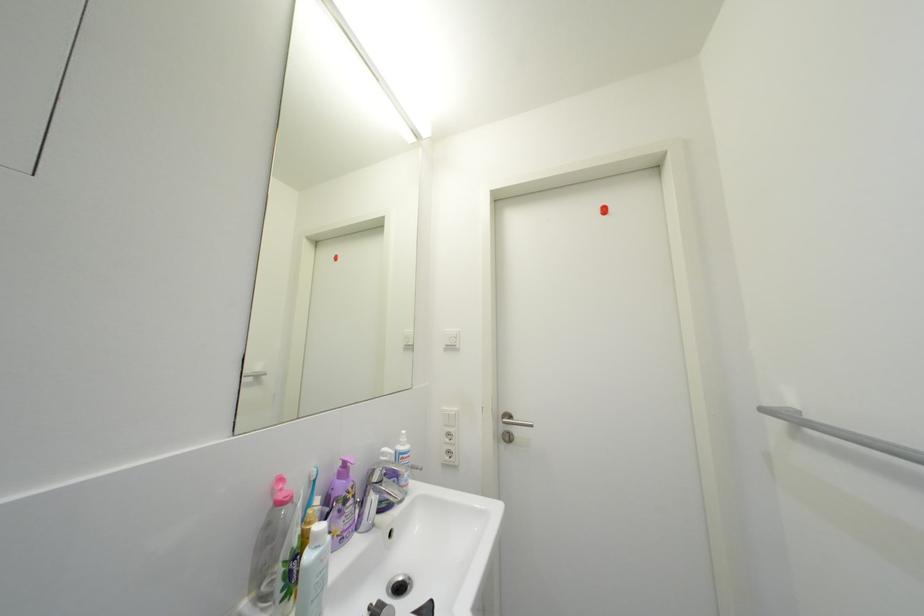
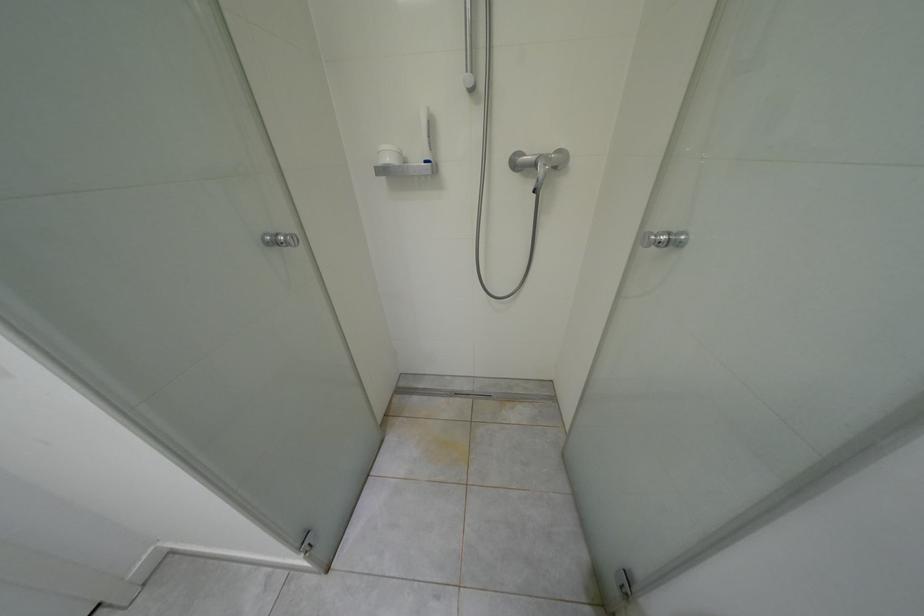
Based on the continuous images, in which direction is the camera rotating?

The camera rotated toward right-down.